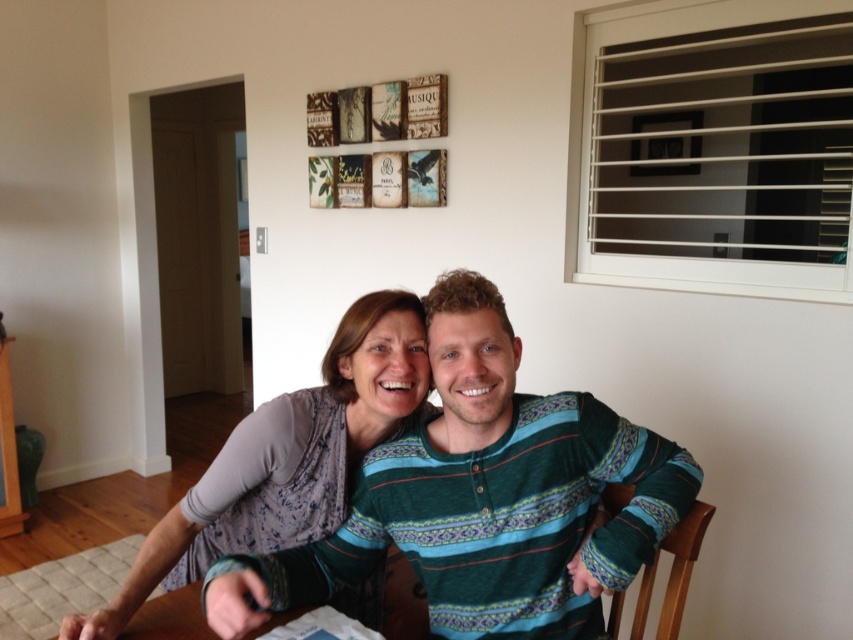
You are a photographer setting up for a portrait session. You need to focus on the striped cotton shirt at center and the matte gray shirt at center. Which shirt should you adjust your camera focus to first to ensure both are in sharp focus?

Result: The striped cotton shirt at center is closer to the viewer than the matte gray shirt at center, so you should focus on the striped cotton shirt at center first. This ensures that both shirts will be in focus due to the depth of field overlapping between the two distances.